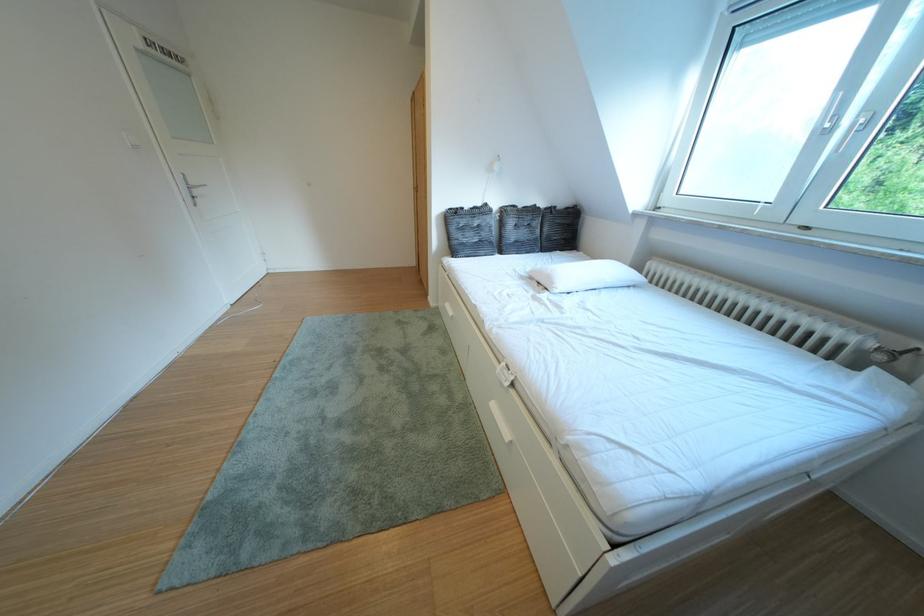
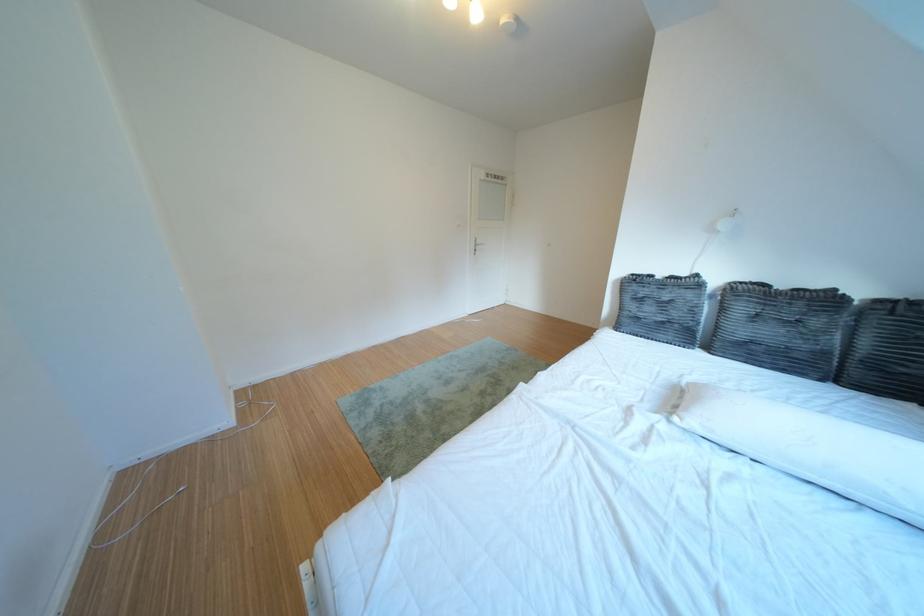
In the second image, find the point that corresponds to the point at 564,213 in the first image.

(910, 306)